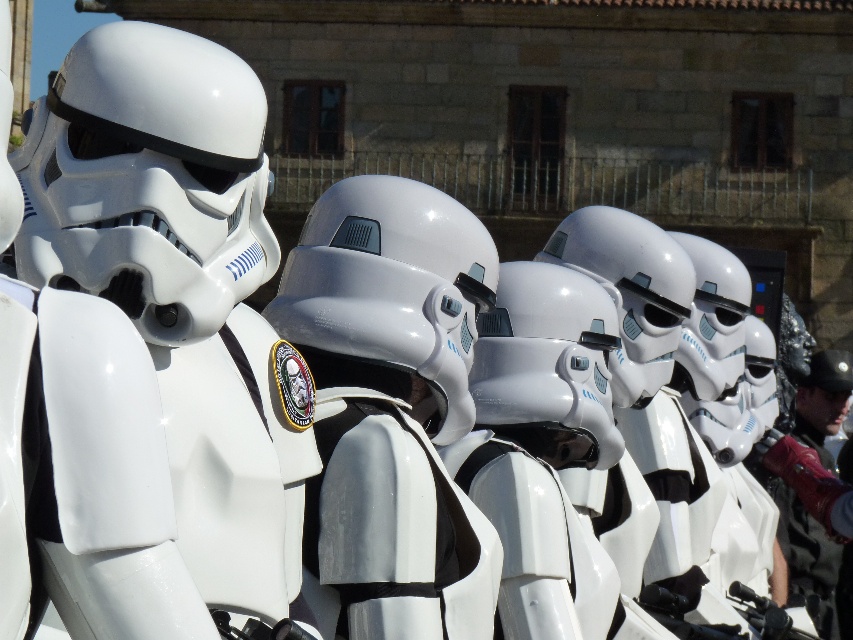
Does matte white helmet at left appear under glossy white helmet at center?

Incorrect, matte white helmet at left is not positioned below glossy white helmet at center.

Between matte white helmet at left and glossy white helmet at center, which one has less height?

glossy white helmet at center

Does point (120, 300) lie in front of point (352, 378)?

Yes, point (120, 300) is closer to viewer.

At what (x,y) coordinates should I click in order to perform the action: click on matte white helmet at left. Please return your answer as a coordinate pair (x, y). This screenshot has width=853, height=640. Looking at the image, I should click on (183, 284).